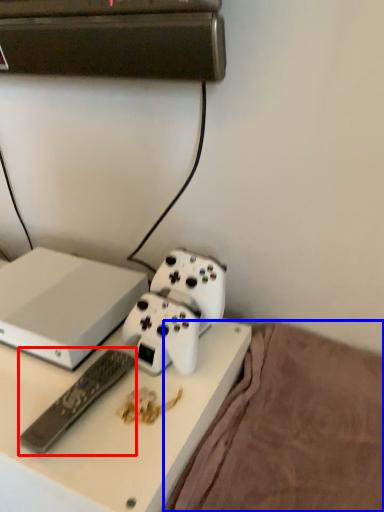
Question: Which of the following is the closest to the observer, remote control (highlighted by a red box) or bedding (highlighted by a blue box)?

Choices:
 (A) remote control
 (B) bedding

Answer: (B)